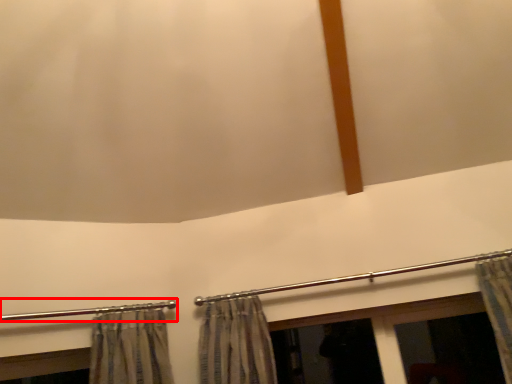
Question: From the image's perspective, considering the relative positions of clothesline (annotated by the red box) and clothesline in the image provided, where is clothesline (annotated by the red box) located with respect to the staircase?

Choices:
 (A) below
 (B) above

Answer: (A)